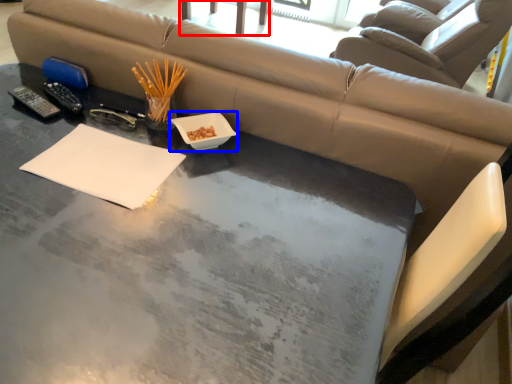
Question: Among these objects, which one is nearest to the camera, chair (highlighted by a red box) or bowl (highlighted by a blue box)?

Choices:
 (A) chair
 (B) bowl

Answer: (B)